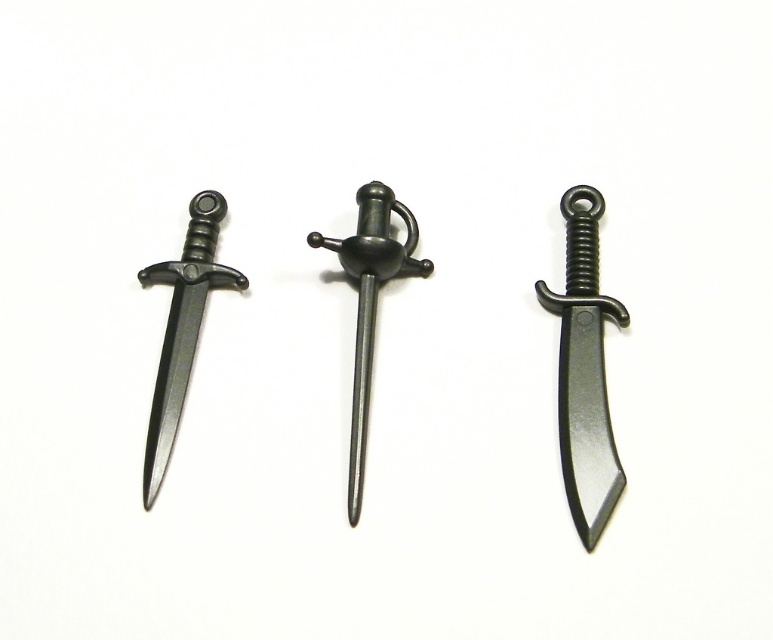
You are an archivist organizing miniature swords. You notice two items labeled as matte black sword at center and matte black blade at center in the image. Which one is physically nearer to you?

The matte black sword at center is closer to the viewer than the matte black blade at center.

You are a collector arranging miniature swords on a display shelf. You have a black matte dagger at center and a matte black blade at center. According to the image, which one is placed above the other?

The black matte dagger at center is positioned over matte black blade at center, so it is placed above the matte black blade at center.

You are an archer standing in the center of the image. You need to aim your arrow at the matte black dagger at left. What coordinates should you aim for?

You should aim for coordinates point [182,326] where the matte black dagger at left is located.